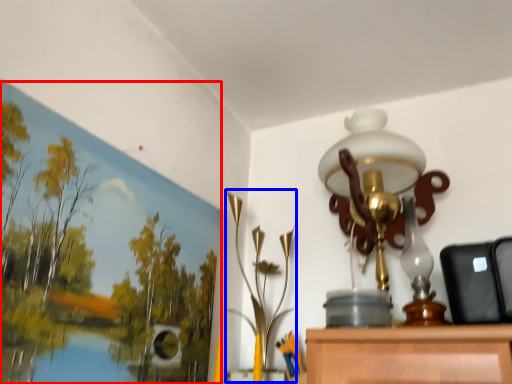
Question: Among these objects, which one is farthest to the camera, oil painting (highlighted by a red box) or lamp (highlighted by a blue box)?

Choices:
 (A) oil painting
 (B) lamp

Answer: (B)